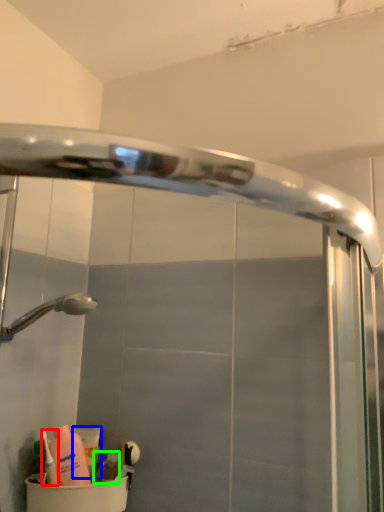
Question: Based on their relative distances, which object is farther from cleaning product (highlighted by a red box)? Choose from cleaning product (highlighted by a blue box) and toiletry (highlighted by a green box).

Choices:
 (A) cleaning product
 (B) toiletry

Answer: (B)